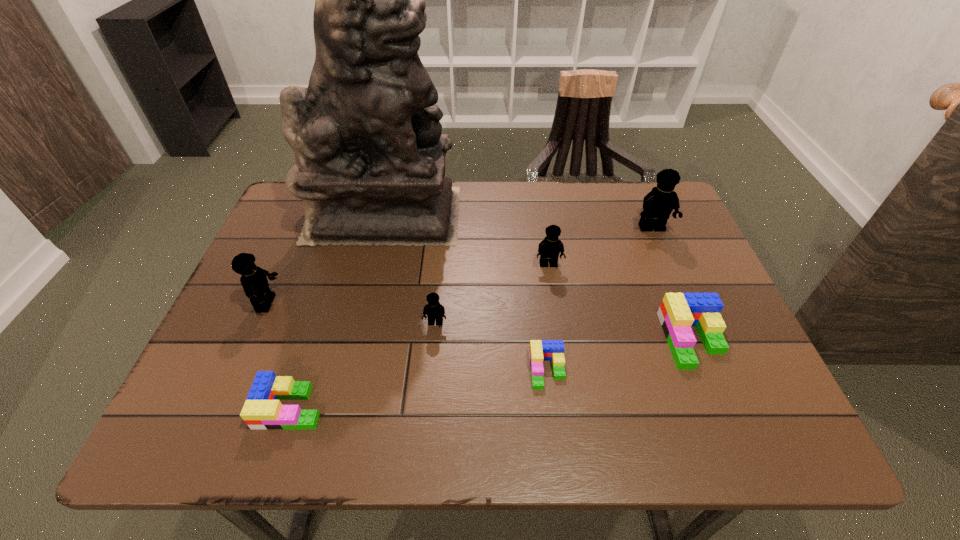
Select which yellow Lego is the third closest to the fourth shortest Lego. Please provide its 2D coordinates. Your answer should be formatted as a tuple, i.e. [(x, y)], where the tuple contains the x and y coordinates of a point satisfying the conditions above.

[(658, 204)]

This screenshot has height=540, width=960. What are the coordinates of `green Lego that stands as the third closest to the leftmost yellow Lego` in the screenshot? It's located at (679, 311).

Identify the location of green Lego identified as the closest to the tallest object. This screenshot has height=540, width=960. (540, 350).

At what (x,y) coordinates should I click in order to perform the action: click on vacant space that satisfies the following two spatial constraints: 1. on the front-facing side of the third tallest Lego; 2. on the front-facing side of the third tallest object. Please return your answer as a coordinate pair (x, y). The height and width of the screenshot is (540, 960). Looking at the image, I should click on (555, 303).

Find the location of a particular element. The image size is (960, 540). vacant space that satisfies the following two spatial constraints: 1. on the front-facing side of the second tallest Lego; 2. on the left side of the sixth Lego from right to left is located at coordinates (222, 407).

The image size is (960, 540). What are the coordinates of `blank space that satisfies the following two spatial constraints: 1. on the front-facing side of the tallest object; 2. on the right side of the third shortest Lego` in the screenshot? It's located at (353, 340).

The width and height of the screenshot is (960, 540). I want to click on vacant space that satisfies the following two spatial constraints: 1. on the front-facing side of the leftmost Lego; 2. on the left side of the sixth Lego from right to left, so click(x=222, y=407).

Where is `free spot that satisfies the following two spatial constraints: 1. on the back side of the third shortest object; 2. on the front-facing side of the sculpture`? free spot that satisfies the following two spatial constraints: 1. on the back side of the third shortest object; 2. on the front-facing side of the sculpture is located at coordinates (641, 214).

You are a GUI agent. You are given a task and a screenshot of the screen. Output one action in this format:
    pyautogui.click(x=<x>, y=<y>)
    Task: Click on the vacant space that satisfies the following two spatial constraints: 1. on the front-facing side of the second biggest yellow Lego; 2. on the back side of the second smallest green Lego
    
    Given the screenshot: What is the action you would take?
    pyautogui.click(x=222, y=407)

At what (x,y) coordinates should I click in order to perform the action: click on free spot that satisfies the following two spatial constraints: 1. on the back side of the shortest object; 2. on the front-facing side of the sculpture. Please return your answer as a coordinate pair (x, y). The image size is (960, 540). Looking at the image, I should click on (528, 214).